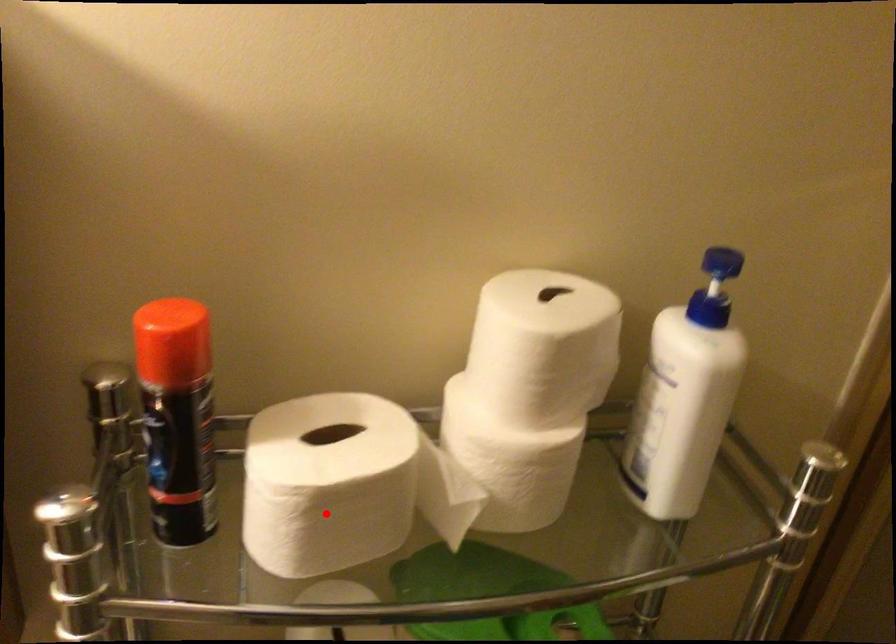
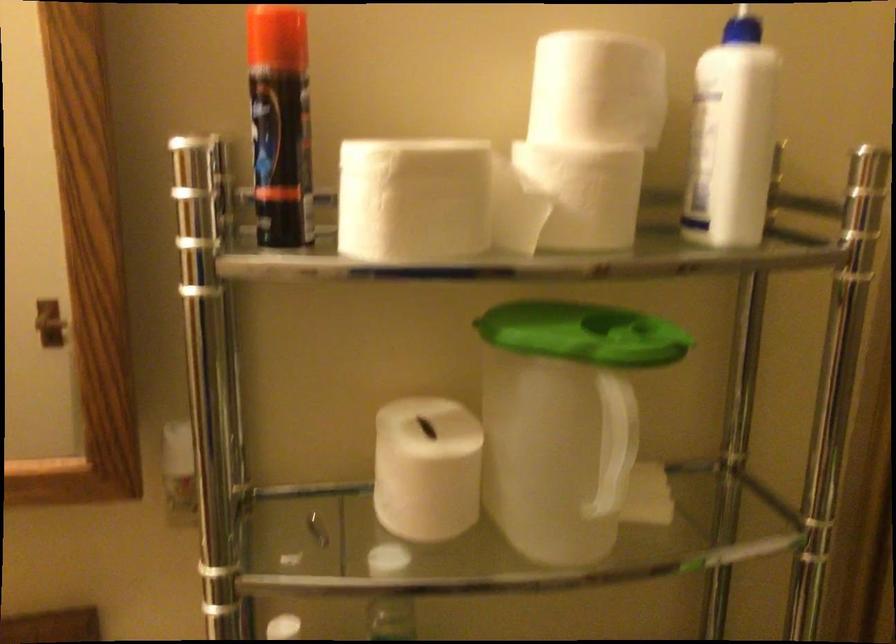
The point at the highlighted location is marked in the first image. Where is the corresponding point in the second image?

(412, 200)